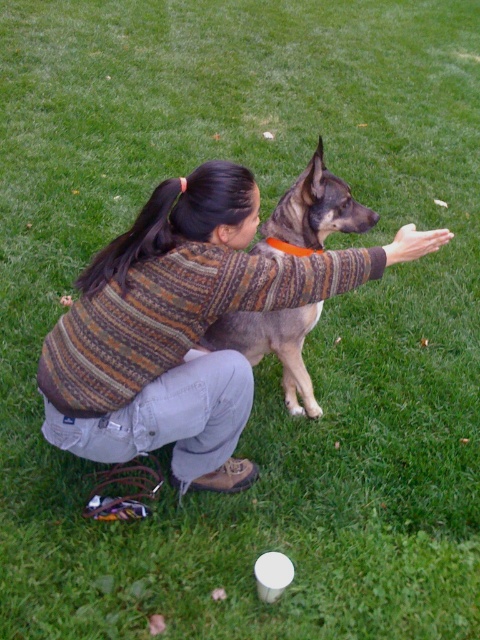
Question: Is knitted sweater at center positioned before brown fur dog at center?

Choices:
 (A) yes
 (B) no

Answer: (A)

Question: Which point is closer to the camera taking this photo?

Choices:
 (A) (310, 385)
 (B) (176, 481)

Answer: (B)

Question: Is the position of knitted sweater at center more distant than that of brown fur dog at center?

Choices:
 (A) no
 (B) yes

Answer: (A)

Question: Is knitted sweater at center behind brown fur dog at center?

Choices:
 (A) yes
 (B) no

Answer: (B)